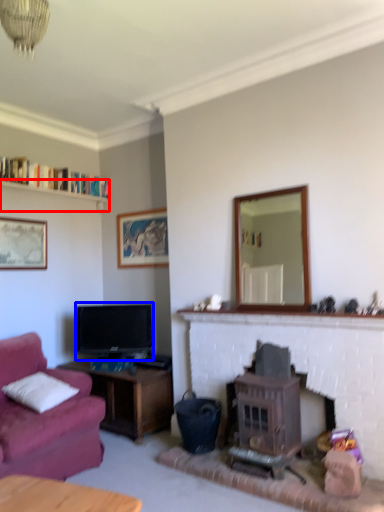
Question: Among these objects, which one is farthest to the camera, shelf (highlighted by a red box) or television (highlighted by a blue box)?

Choices:
 (A) shelf
 (B) television

Answer: (B)